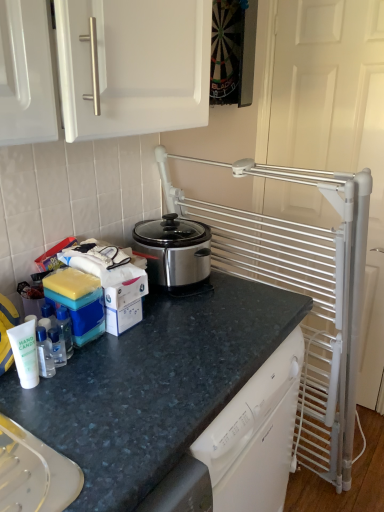
Question: Is clear plastic bottle at lower left, marked as the second bottle in a front-to-back arrangement, to the left of clear plastic bottle at left, positioned as the fourth bottle in front-to-back order, from the viewer's perspective?

Choices:
 (A) yes
 (B) no

Answer: (A)

Question: Considering the relative sizes of clear plastic bottle at lower left, marked as the second bottle in a front-to-back arrangement, and clear plastic bottle at left, positioned as the fourth bottle in front-to-back order, in the image provided, is clear plastic bottle at lower left, marked as the second bottle in a front-to-back arrangement, taller than clear plastic bottle at left, positioned as the fourth bottle in front-to-back order,?

Choices:
 (A) no
 (B) yes

Answer: (A)

Question: Is clear plastic bottle at lower left, which is the 3th bottle from back to front, aimed at clear plastic bottle at left, positioned as the fourth bottle in front-to-back order?

Choices:
 (A) no
 (B) yes

Answer: (A)

Question: Does clear plastic bottle at lower left, marked as the second bottle in a front-to-back arrangement, have a greater width compared to clear plastic bottle at left, positioned as the fourth bottle in front-to-back order?

Choices:
 (A) yes
 (B) no

Answer: (A)

Question: Is clear plastic bottle at lower left, marked as the second bottle in a front-to-back arrangement, looking in the opposite direction of clear plastic bottle at left, the first bottle viewed from the back?

Choices:
 (A) no
 (B) yes

Answer: (A)

Question: Considering the positions of clear plastic bottle at lower left, marked as the second bottle in a front-to-back arrangement, and white matte hand sanitizer at lower left, which is the fourth bottle from back to front, in the image, is clear plastic bottle at lower left, marked as the second bottle in a front-to-back arrangement, bigger or smaller than white matte hand sanitizer at lower left, which is the fourth bottle from back to front,?

Choices:
 (A) big
 (B) small

Answer: (B)

Question: Is point (44, 347) positioned closer to the camera than point (14, 362)?

Choices:
 (A) closer
 (B) farther

Answer: (B)

Question: From the image's perspective, relative to white matte hand sanitizer at lower left, which is the fourth bottle from back to front, is clear plastic bottle at lower left, marked as the second bottle in a front-to-back arrangement, above or below?

Choices:
 (A) above
 (B) below

Answer: (A)

Question: From a real-world perspective, is clear plastic bottle at lower left, which is the 3th bottle from back to front, physically located above or below white matte hand sanitizer at lower left, the 1th bottle viewed from the front?

Choices:
 (A) below
 (B) above

Answer: (A)

Question: Considering the positions of white matte hand sanitizer at lower left, which is the fourth bottle from back to front, and white metal screen door at right in the image, is white matte hand sanitizer at lower left, which is the fourth bottle from back to front, bigger or smaller than white metal screen door at right?

Choices:
 (A) small
 (B) big

Answer: (A)

Question: Do you think white matte hand sanitizer at lower left, the 1th bottle viewed from the front, is within white metal screen door at right, or outside of it?

Choices:
 (A) inside
 (B) outside

Answer: (B)

Question: From a real-world perspective, relative to white metal screen door at right, is white matte hand sanitizer at lower left, which is the fourth bottle from back to front, vertically above or below?

Choices:
 (A) above
 (B) below

Answer: (A)

Question: Considering the relative positions of white matte hand sanitizer at lower left, which is the fourth bottle from back to front, and white metal screen door at right in the image provided, is white matte hand sanitizer at lower left, which is the fourth bottle from back to front, to the left or to the right of white metal screen door at right?

Choices:
 (A) right
 (B) left

Answer: (B)

Question: Looking at their shapes, would you say clear plastic bottle at left, arranged as the third bottle when viewed from the front, is wider or thinner than granite dark blue countertop at center?

Choices:
 (A) thin
 (B) wide

Answer: (A)

Question: From the image's perspective, is clear plastic bottle at left, arranged as the third bottle when viewed from the front, positioned above or below granite dark blue countertop at center?

Choices:
 (A) above
 (B) below

Answer: (A)